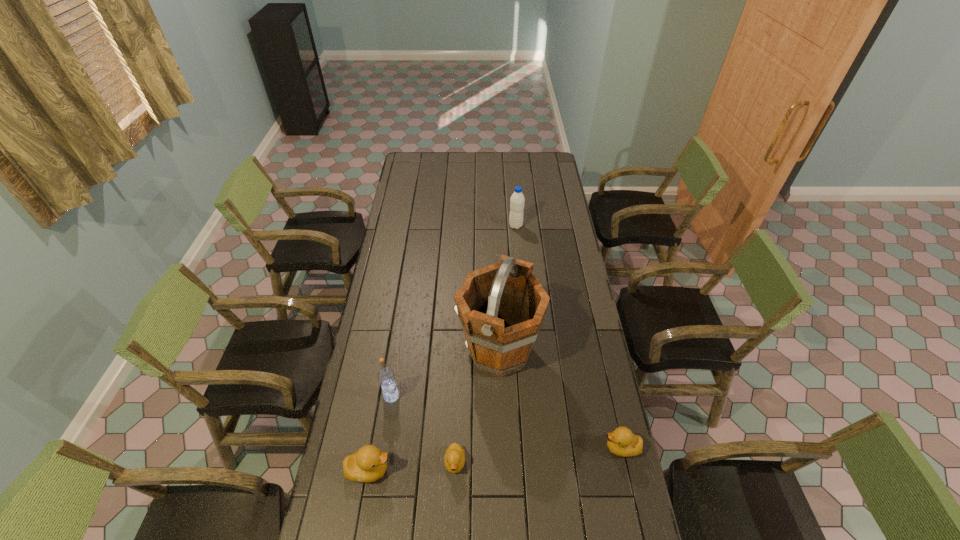
Find the location of a particular element. This screenshot has width=960, height=540. object present at the right edge is located at coordinates (622, 442).

This screenshot has height=540, width=960. What are the coordinates of `free spot at the far edge of the desktop` in the screenshot? It's located at (478, 165).

Locate an element on the screen. This screenshot has width=960, height=540. vacant space at the near edge of the desktop is located at coordinates (507, 524).

The height and width of the screenshot is (540, 960). In the image, there is a desktop. What are the coordinates of `free region at the left edge` in the screenshot? It's located at (413, 215).

The image size is (960, 540). In the image, there is a desktop. What are the coordinates of `vacant space at the right edge` in the screenshot? It's located at click(x=575, y=336).

The width and height of the screenshot is (960, 540). Find the location of `free space that is in between the second tallest duckling and the farthest object`. free space that is in between the second tallest duckling and the farthest object is located at coordinates [x=568, y=337].

At what (x,y) coordinates should I click in order to perform the action: click on free spot between the tallest duckling and the vodka. Please return your answer as a coordinate pair (x, y). This screenshot has height=540, width=960. Looking at the image, I should click on (380, 433).

The height and width of the screenshot is (540, 960). Identify the location of blank region between the vodka and the shortest duckling. (423, 429).

This screenshot has height=540, width=960. I want to click on free space between the fourth tallest object and the vodka, so click(x=380, y=433).

You are a GUI agent. You are given a task and a screenshot of the screen. Output one action in this format:
    pyautogui.click(x=<x>, y=<y>)
    Task: Click on the vacant space that is in between the third farthest object and the farthest object
    Image resolution: width=960 pixels, height=540 pixels.
    Given the screenshot: What is the action you would take?
    pyautogui.click(x=453, y=311)